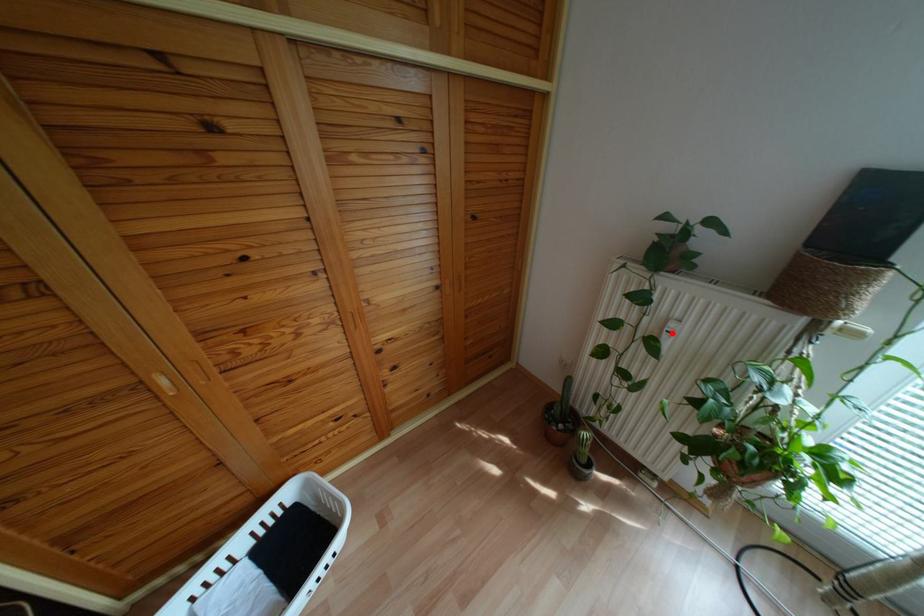
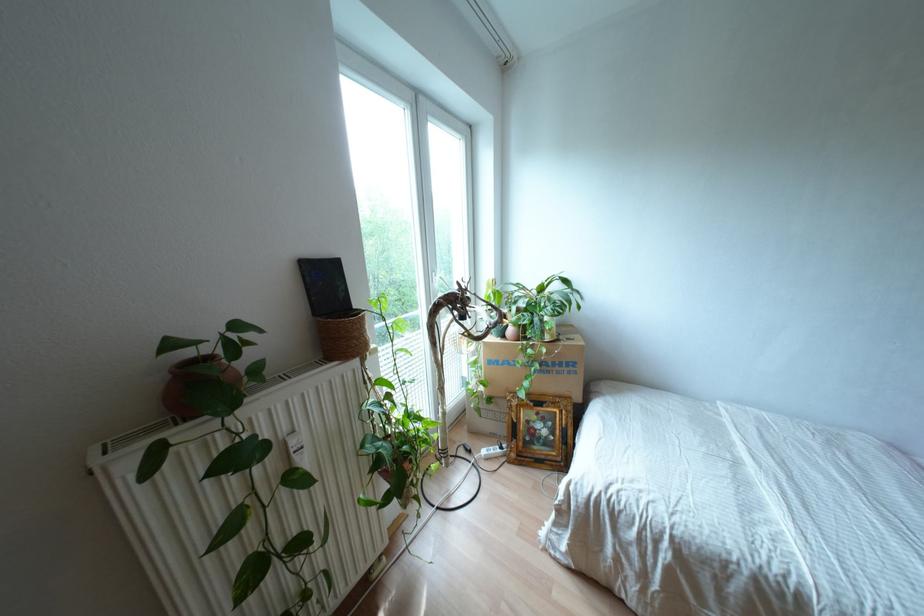
Locate, in the second image, the point that corresponds to the highlighted location in the first image.

(301, 448)